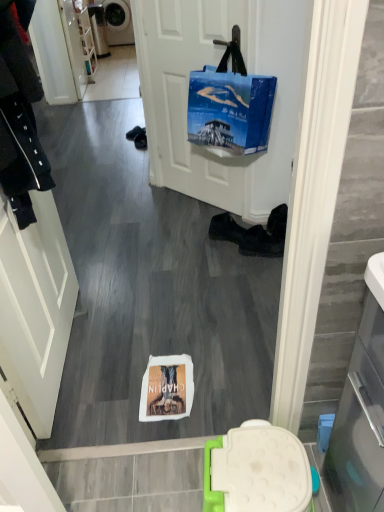
Question: In which direction should I rotate to look at black leather boots at lower center, arranged as the 1th footwear when viewed from the right?

Choices:
 (A) right
 (B) left

Answer: (A)

Question: Is metallic gray washing machine at upper left positioned before white paper bag at center?

Choices:
 (A) no
 (B) yes

Answer: (A)

Question: Is metallic gray washing machine at upper left wider than white paper bag at center?

Choices:
 (A) no
 (B) yes

Answer: (B)

Question: Considering the relative sizes of metallic gray washing machine at upper left and white paper bag at center in the image provided, is metallic gray washing machine at upper left shorter than white paper bag at center?

Choices:
 (A) no
 (B) yes

Answer: (A)

Question: From a real-world perspective, is metallic gray washing machine at upper left physically above white paper bag at center?

Choices:
 (A) no
 (B) yes

Answer: (B)

Question: From the image's perspective, would you say metallic gray washing machine at upper left is shown under white paper bag at center?

Choices:
 (A) yes
 (B) no

Answer: (B)

Question: Considering the relative positions of metallic gray washing machine at upper left and white paper bag at center in the image provided, is metallic gray washing machine at upper left to the right of white paper bag at center from the viewer's perspective?

Choices:
 (A) no
 (B) yes

Answer: (A)

Question: Considering the relative sizes of metallic gray washing machine at upper left and black leather shoe at lower center in the image provided, is metallic gray washing machine at upper left bigger than black leather shoe at lower center?

Choices:
 (A) no
 (B) yes

Answer: (B)

Question: Is metallic gray washing machine at upper left far from black leather shoe at lower center?

Choices:
 (A) yes
 (B) no

Answer: (A)

Question: Can you confirm if metallic gray washing machine at upper left is taller than black leather shoe at lower center?

Choices:
 (A) yes
 (B) no

Answer: (A)

Question: Is metallic gray washing machine at upper left not within black leather shoe at lower center?

Choices:
 (A) yes
 (B) no

Answer: (A)

Question: Does metallic gray washing machine at upper left have a smaller size compared to black leather shoe at lower center?

Choices:
 (A) no
 (B) yes

Answer: (A)

Question: Could you tell me if metallic gray washing machine at upper left is turned towards black leather shoe at lower center?

Choices:
 (A) no
 (B) yes

Answer: (B)

Question: Can you confirm if metallic gray washing machine at upper left is taller than white matte door at center?

Choices:
 (A) no
 (B) yes

Answer: (A)